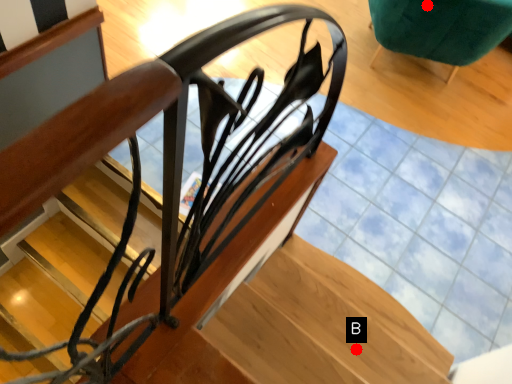
Question: Two points are circled on the image, labeled by A and B beside each circle. Which point is farther from the camera taking this photo?

Choices:
 (A) A is further
 (B) B is further

Answer: (A)